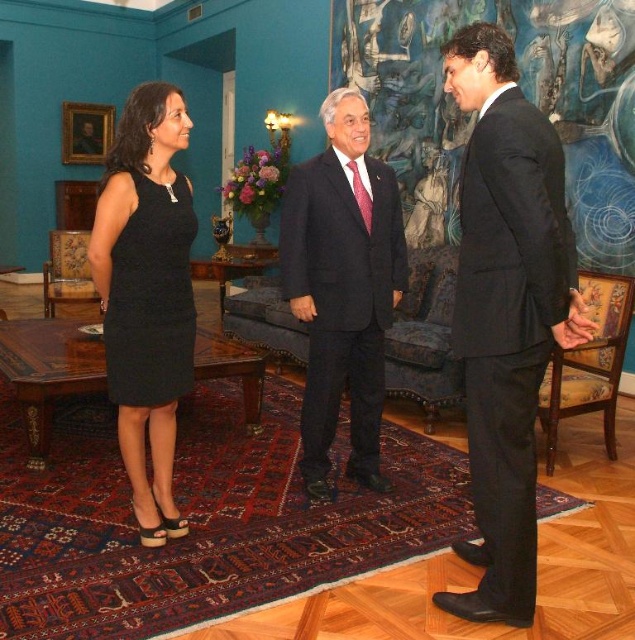
Question: Is black suit at right positioned in front of black matte suit at center?

Choices:
 (A) yes
 (B) no

Answer: (A)

Question: Which object is positioned closest to the black textured dress at left?

Choices:
 (A) black woven dress at left
 (B) black suit at right

Answer: (A)

Question: Estimate the real-world distances between objects in this image. Which object is farther from the black suit at right?

Choices:
 (A) black matte suit at center
 (B) black textured dress at left

Answer: (B)

Question: Can you confirm if black suit at right is smaller than black textured dress at left?

Choices:
 (A) yes
 (B) no

Answer: (B)

Question: Does black matte suit at center have a lesser width compared to black textured dress at left?

Choices:
 (A) yes
 (B) no

Answer: (B)

Question: Which object is the closest to the black matte suit at center?

Choices:
 (A) black textured dress at left
 (B) black suit at right

Answer: (A)